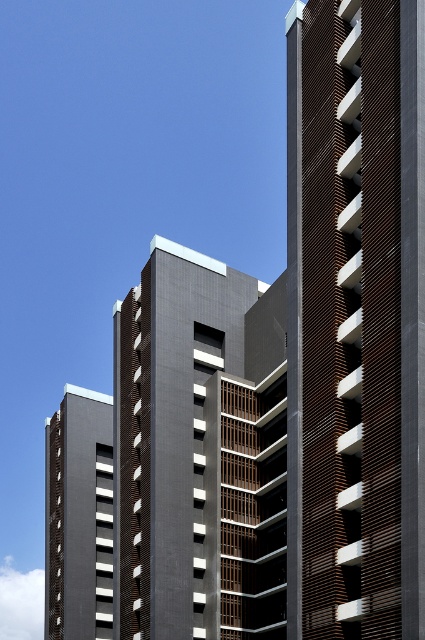
You are a drone operator tasked with capturing aerial footage of the dark gray concrete building at center and the dark gray concrete building at lower left. Your drone has a maximum flight range of 20 meters. Can you fly your drone from one building to the other without exceeding its range?

The distance between the dark gray concrete building at center and the dark gray concrete building at lower left is 20.61 meters, which exceeds the drone maximum flight range of 20 meters. Therefore, the drone cannot fly between them without exceeding its range.

You are standing at the origin point of a coordinate system where the image is mapped. The dark gray concrete building at center is at point 0.708, 0.468. If you want to walk directly towards it from your current position, which direction should you head?

To walk directly towards the dark gray concrete building at center located at coordinates [198,452] from the origin, you should move in the positive x and positive y direction since both coordinates are greater than zero.